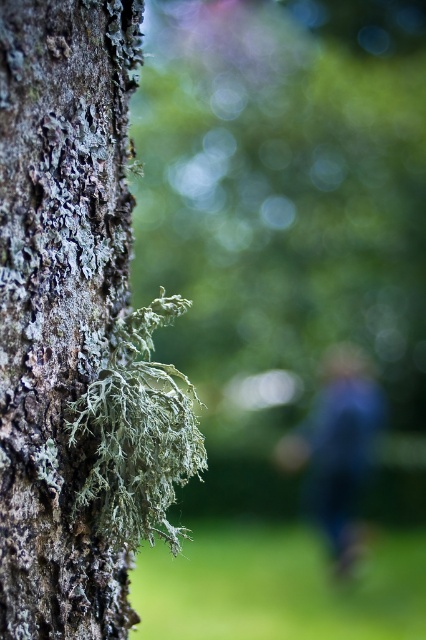
From the picture: You are a botanist examining a tree trunk. You notice a green mossy bark at left. Can you determine its exact location using coordinates?

The green mossy bark at left is located at coordinates point (x=60, y=298).

You are a photographer standing in a forest. You want to take a photo of the green mossy bark at left and the blue fabric at center. If your camera has a maximum focus range of 15 feet, will both objects be in focus at the same time?

The distance between the green mossy bark at left and the blue fabric at center is 17.89 feet, which exceeds the camera maximum focus range of 15 feet. Therefore, both objects cannot be in focus simultaneously.

You are an artist trying to paint the scene. You want to ensure the green mossy bark at left and blue fabric at center are proportionally accurate. Which object should be drawn shorter in your painting?

The green mossy bark at left should be drawn shorter since it has a lesser height compared to the blue fabric at center.